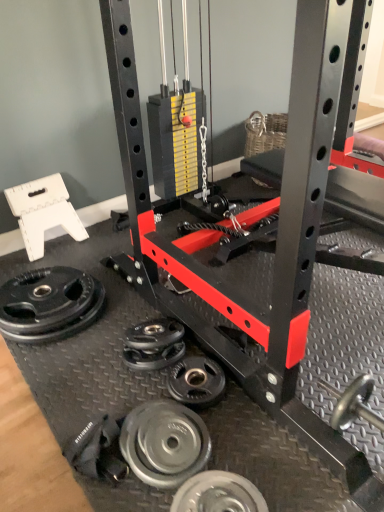
Question: Considering the relative sizes of silver metallic weight plate at lower center, the second wheel from the bottom, and black rubber weight plate at lower left, which appears as the fourth wheel when viewed from the right, in the image provided, is silver metallic weight plate at lower center, the second wheel from the bottom, wider than black rubber weight plate at lower left, which appears as the fourth wheel when viewed from the right,?

Choices:
 (A) no
 (B) yes

Answer: (A)

Question: Could you tell me if silver metallic weight plate at lower center, the second wheel from the bottom, is turned towards black rubber weight plate at lower left, which appears as the first wheel when viewed from the left?

Choices:
 (A) yes
 (B) no

Answer: (B)

Question: Is silver metallic weight plate at lower center, which ranks as the second wheel in front-to-back order, at the right side of black rubber weight plate at lower left, which appears as the first wheel when viewed from the left?

Choices:
 (A) no
 (B) yes

Answer: (B)

Question: Does silver metallic weight plate at lower center, arranged as the 3th wheel when viewed from the back, have a larger size compared to black rubber weight plate at lower left, which appears as the fourth wheel when viewed from the right?

Choices:
 (A) no
 (B) yes

Answer: (A)

Question: From a real-world perspective, is silver metallic weight plate at lower center, which ranks as the second wheel in front-to-back order, positioned under black rubber weight plate at lower left, which ranks as the 4th wheel in bottom-to-top order, based on gravity?

Choices:
 (A) yes
 (B) no

Answer: (B)

Question: Is silver metallic weight plate at lower center, the 3th wheel when ordered from top to bottom, positioned far away from black rubber weight plate at lower left, which appears as the fourth wheel when viewed from the right?

Choices:
 (A) no
 (B) yes

Answer: (A)

Question: Is silver metallic weight plate at lower center, which is counted as the third wheel, starting from the right, wider than silver metallic weight plate at lower center, which appears as the 1th wheel when viewed from the right?

Choices:
 (A) yes
 (B) no

Answer: (A)

Question: From a real-world perspective, is silver metallic weight plate at lower center, arranged as the 3th wheel when viewed from the back, located higher than silver metallic weight plate at lower center, which ranks as the first wheel in front-to-back order?

Choices:
 (A) yes
 (B) no

Answer: (A)

Question: Considering the relative positions of silver metallic weight plate at lower center, the second wheel from the bottom, and silver metallic weight plate at lower center, the fourth wheel in the top-to-bottom sequence, in the image provided, is silver metallic weight plate at lower center, the second wheel from the bottom, behind silver metallic weight plate at lower center, the fourth wheel in the top-to-bottom sequence,?

Choices:
 (A) yes
 (B) no

Answer: (A)

Question: Does silver metallic weight plate at lower center, arranged as the 3th wheel when viewed from the back, come in front of silver metallic weight plate at lower center, the fourth wheel in the top-to-bottom sequence?

Choices:
 (A) yes
 (B) no

Answer: (B)

Question: Considering the relative sizes of silver metallic weight plate at lower center, the second wheel from the bottom, and silver metallic weight plate at lower center, which appears as the 1th wheel when viewed from the right, in the image provided, is silver metallic weight plate at lower center, the second wheel from the bottom, shorter than silver metallic weight plate at lower center, which appears as the 1th wheel when viewed from the right,?

Choices:
 (A) no
 (B) yes

Answer: (A)

Question: From the image's perspective, would you say silver metallic weight plate at lower center, the 3th wheel when ordered from top to bottom, is shown under silver metallic weight plate at lower center, marked as the 1th wheel in a bottom-to-top arrangement?

Choices:
 (A) yes
 (B) no

Answer: (B)

Question: Does silver metallic weight plate at lower center, which appears as the 4th wheel when viewed from the back, have a greater width compared to black rubber weight plate at lower left, which appears as the fourth wheel when viewed from the right?

Choices:
 (A) no
 (B) yes

Answer: (A)